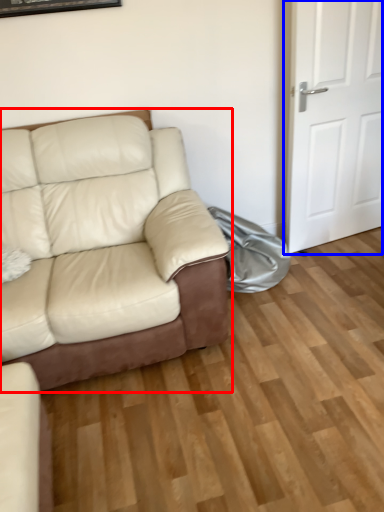
Question: Which point is closer to the camera, studio couch (highlighted by a red box) or door (highlighted by a blue box)?

Choices:
 (A) studio couch
 (B) door

Answer: (A)